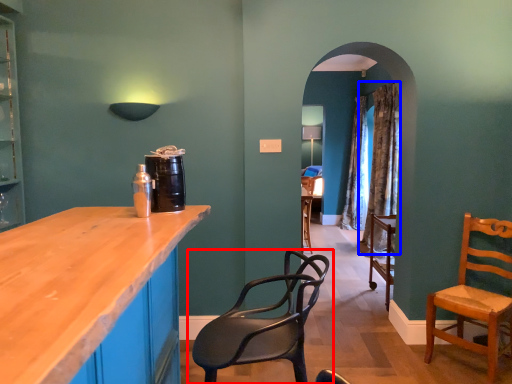
Question: Among these objects, which one is farthest to the camera, chair (highlighted by a red box) or curtain (highlighted by a blue box)?

Choices:
 (A) chair
 (B) curtain

Answer: (B)